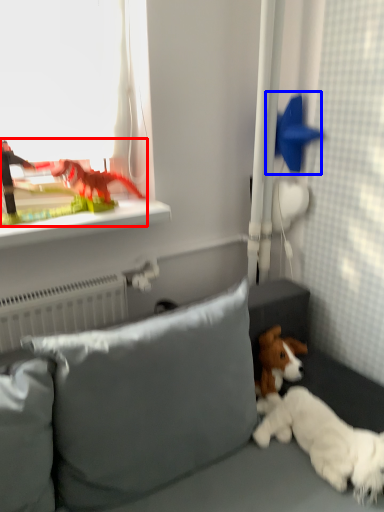
Question: Which of the following is the farthest to the observer, toy (highlighted by a red box) or toy (highlighted by a blue box)?

Choices:
 (A) toy
 (B) toy

Answer: (B)